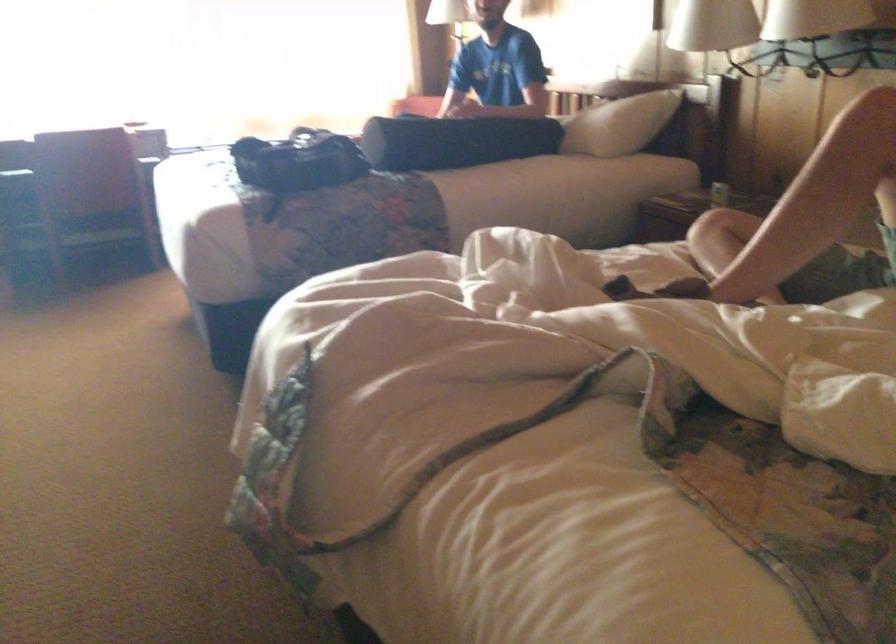
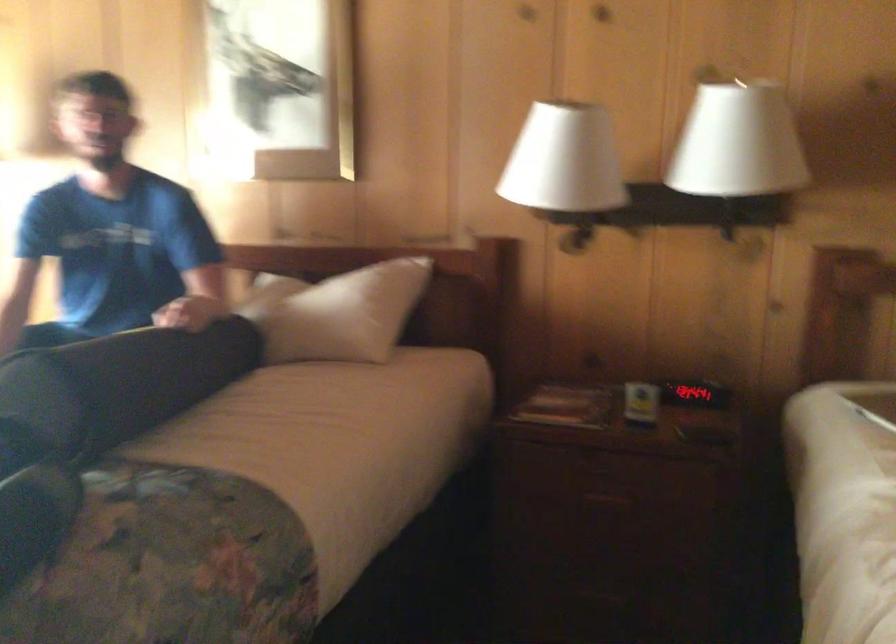
Locate, in the second image, the point that corresponds to (x=399, y=129) in the first image.

(122, 383)